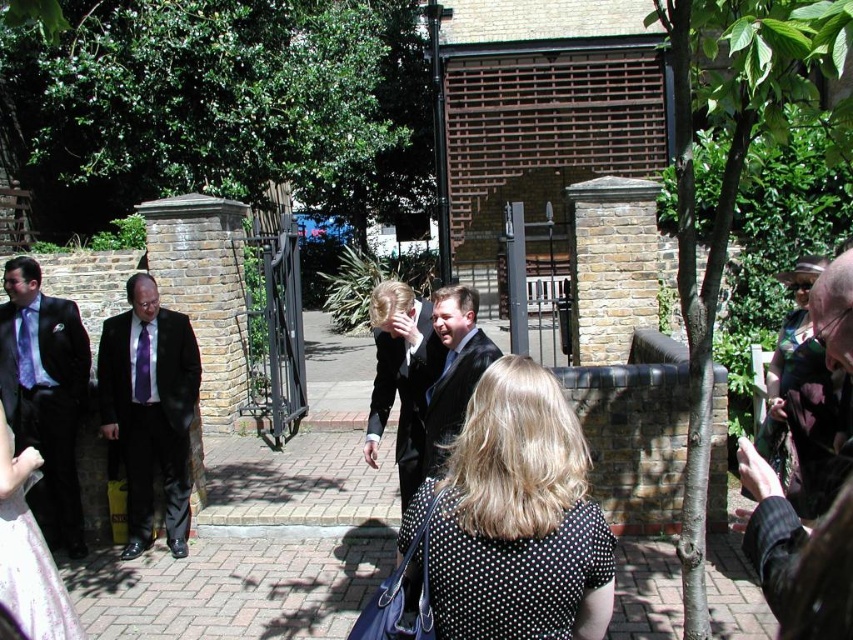
Question: Among these points, which one is nearest to the camera?

Choices:
 (A) [x=27, y=349]
 (B) [x=140, y=348]

Answer: (B)

Question: Which point is closer to the camera?

Choices:
 (A) purple satin tie at center
 (B) silvery sequined dress at lower left

Answer: (B)

Question: Can you confirm if black dotted dress at center is positioned below matte purple tie at left?

Choices:
 (A) no
 (B) yes

Answer: (A)

Question: Which object is closer to the camera taking this photo?

Choices:
 (A) black satin suit at center
 (B) black dotted dress at center
 (C) purple satin tie at left
 (D) purple satin tie at center

Answer: (B)

Question: Considering the relative positions of black dotted dress at center and matte black suit at center in the image provided, where is black dotted dress at center located with respect to matte black suit at center?

Choices:
 (A) left
 (B) right

Answer: (B)

Question: Is black dotted dress at center thinner than purple satin tie at center?

Choices:
 (A) no
 (B) yes

Answer: (A)